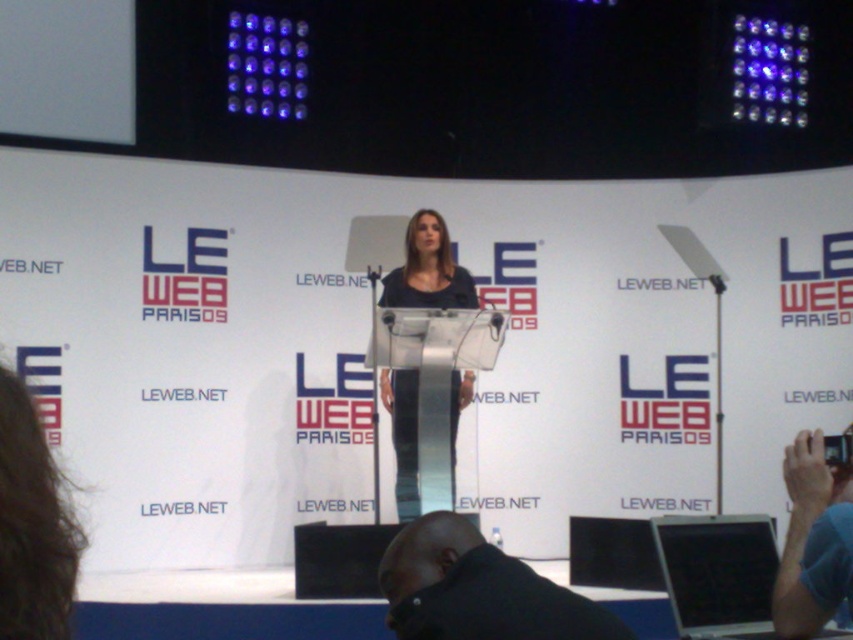
Consider the image. You are an event photographer at the Le Web Paris 09 conference. You need to capture a photo of the speaker wearing both the black matte shirt at lower center and the matte black dress at center. However, your camera can only focus on one clothing item at a time. Which clothing item should you focus on to ensure it is fully visible in the photo?

The black matte shirt at lower center is shorter than the matte black dress at center. Therefore, focusing on the matte black dress at center ensures it will be fully visible in the photo since it is longer and more likely to be within the camera frame.

You are an attendee at the Le Web Paris 09 event and need to locate the white plastic laptop at lower right. Based on the coordinates provided in the description, can you determine its position relative to the stage and the speaker?

The white plastic laptop at lower right is located at coordinates point (718, 573), which places it near the lower right corner of the image, far from the stage and the speaker.

You are a photographer at the event and need to capture a closeup of the speaker while also including the laptop. Given the spatial relationship between the black matte shirt at lower center and the white plastic laptop at lower right, will you need to adjust your camera angle to include both in the frame?

The black matte shirt at lower center occupies less space than the white plastic laptop at lower right. To include both in the frame, you may need to adjust your camera angle to accommodate the larger size of the white plastic laptop at lower right.